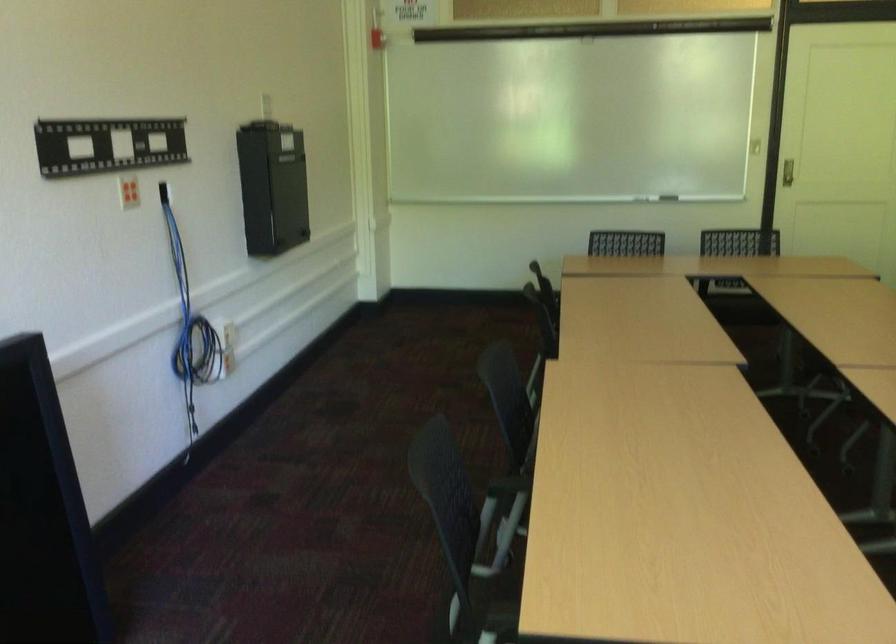
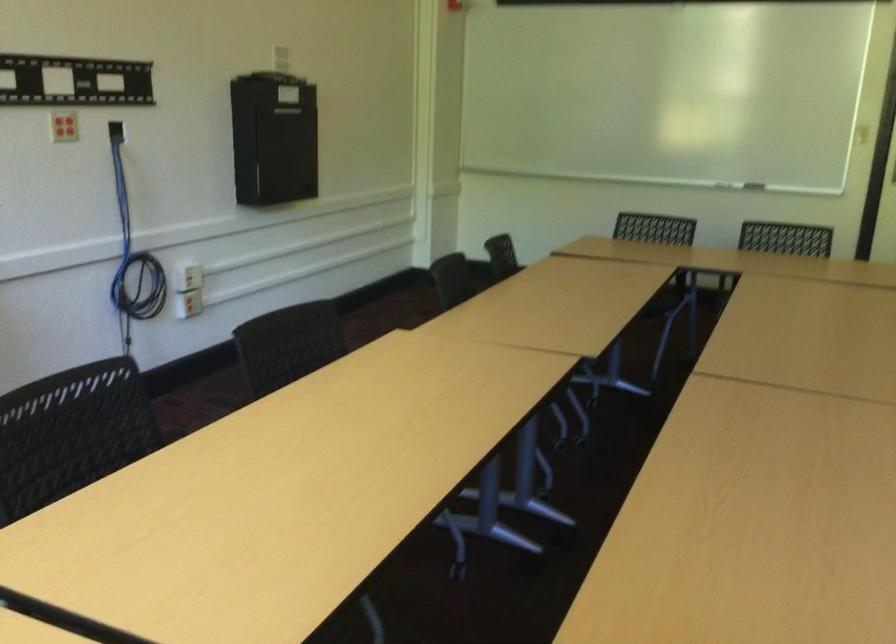
Locate, in the second image, the point that corresponds to (421,498) in the first image.

(71, 433)